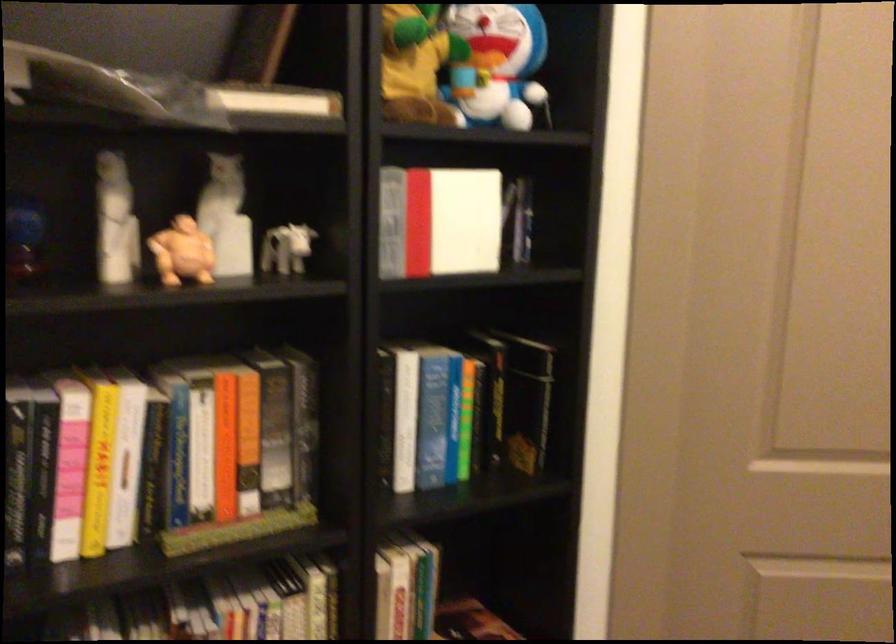
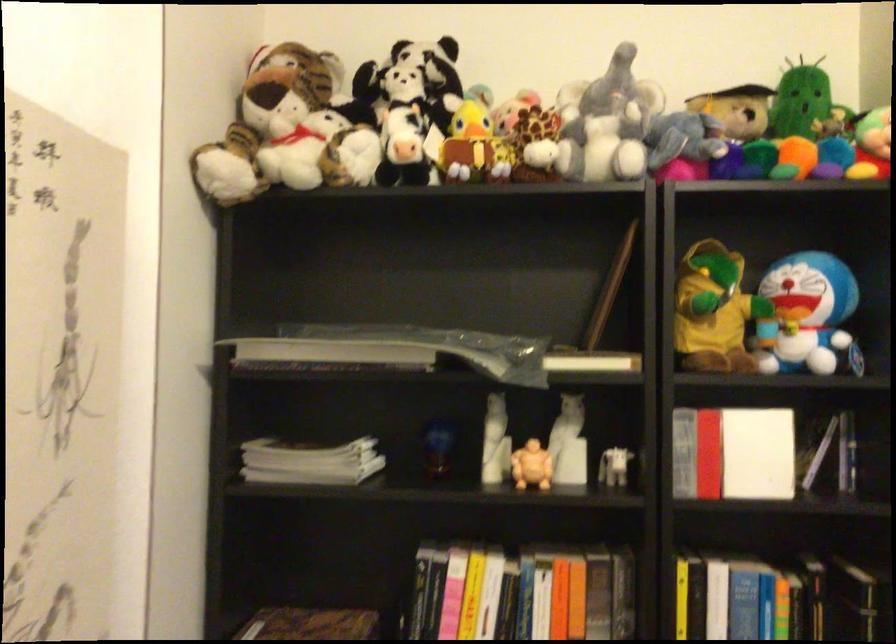
Where in the second image is the point corresponding to point 126,442 from the first image?

(485, 599)